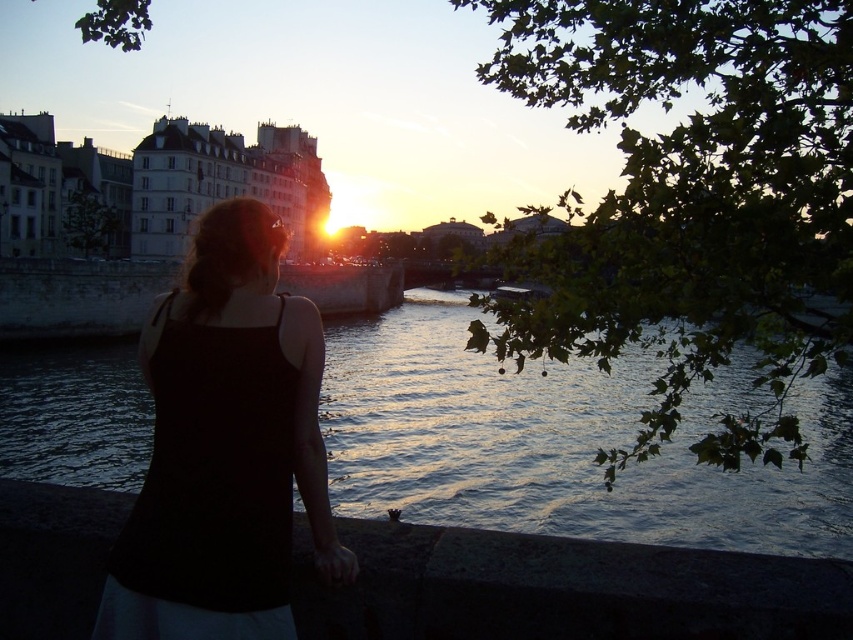
Locate an element on the screen. The image size is (853, 640). dark blue water at center is located at coordinates (564, 442).

Consider the image. Who is more forward, [367,330] or [270,378]?

Positioned in front is point [270,378].

This screenshot has width=853, height=640. Find the location of `dark blue water at center`. dark blue water at center is located at coordinates (564, 442).

Locate an element on the screen. The image size is (853, 640). dark blue water at center is located at coordinates (564, 442).

Based on the photo, does black fabric dress at center have a lesser height compared to dark concrete ledge at lower center?

No.

Between black fabric dress at center and dark concrete ledge at lower center, which one has more height?

Standing taller between the two is black fabric dress at center.

Between point (316, 419) and point (3, 566), which one is positioned in front?

Point (3, 566) is more forward.

I want to click on black fabric dress at center, so click(x=225, y=448).

Is dark blue water at center further to camera compared to dark concrete ledge at lower center?

Yes, it is behind dark concrete ledge at lower center.

Who is shorter, dark blue water at center or dark concrete ledge at lower center?

dark concrete ledge at lower center is shorter.

Measure the distance between point (764, 552) and camera.

Point (764, 552) is 92.46 meters from camera.

I want to click on dark blue water at center, so click(564, 442).